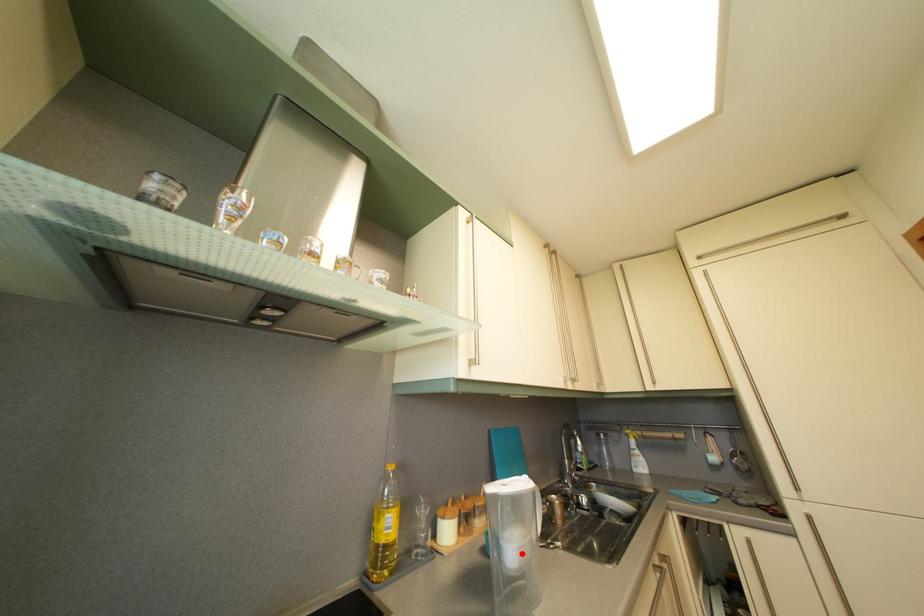
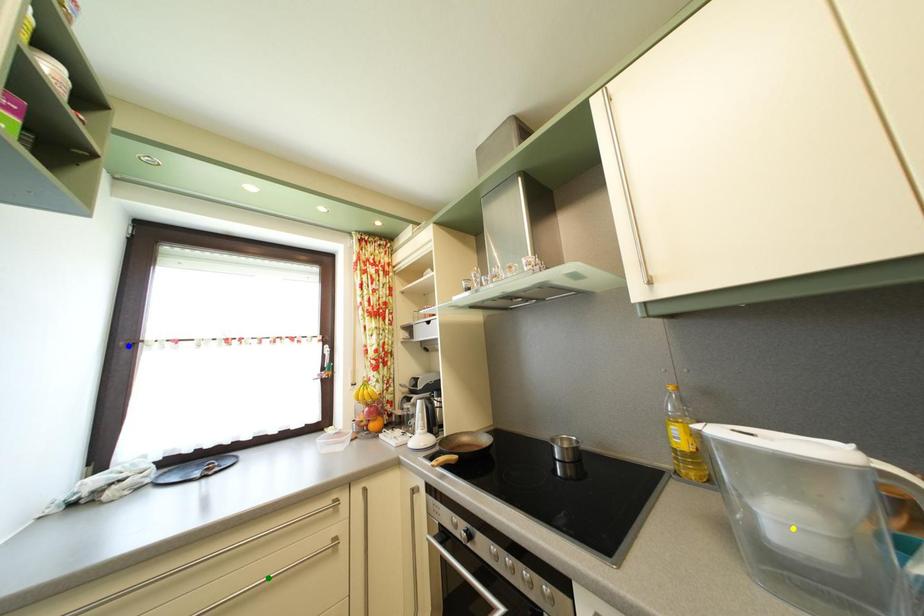
Question: I am providing you with two images of the same scene from different viewpoints. A red point is marked on the first image. You are given multiple points on the second image. Can you choose the point in image 2 that corresponds to the point in image 1?

Choices:
 (A) yellow point
 (B) blue point
 (C) green point

Answer: (A)